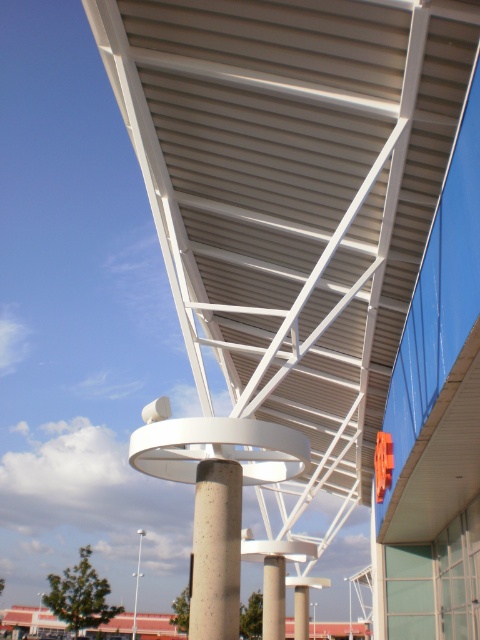
You are an architect inspecting the structural integrity of the building. You notice the concrete column at center and the white concrete pole at center. Which one is directly above the other?

The concrete column at center is positioned over the white concrete pole at center, so the concrete column at center is directly above the white concrete pole at center.

You are an architect inspecting the structure. You notice the concrete textured column at center and the concrete pillar at center. Which one is positioned higher in the image?

The concrete textured column at center is positioned higher than the concrete pillar at center.